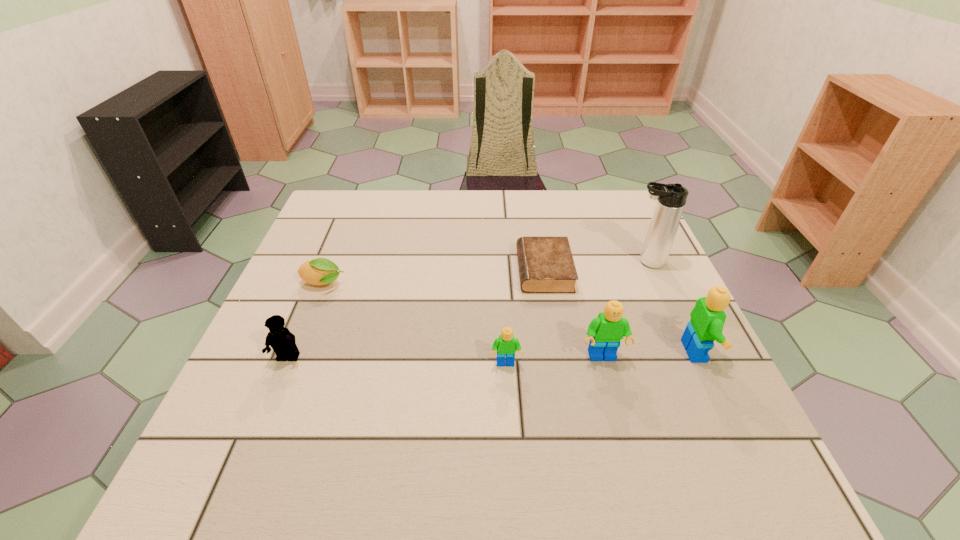
All Legos are currently evenly spaced. To continue this pattern, where would you add another Lego on the left? Please point out a vacant spot. Please provide its 2D coordinates. Your answer should be formatted as a tuple, i.e. [(x, y)], where the tuple contains the x and y coordinates of a point satisfying the conditions above.

[(406, 371)]